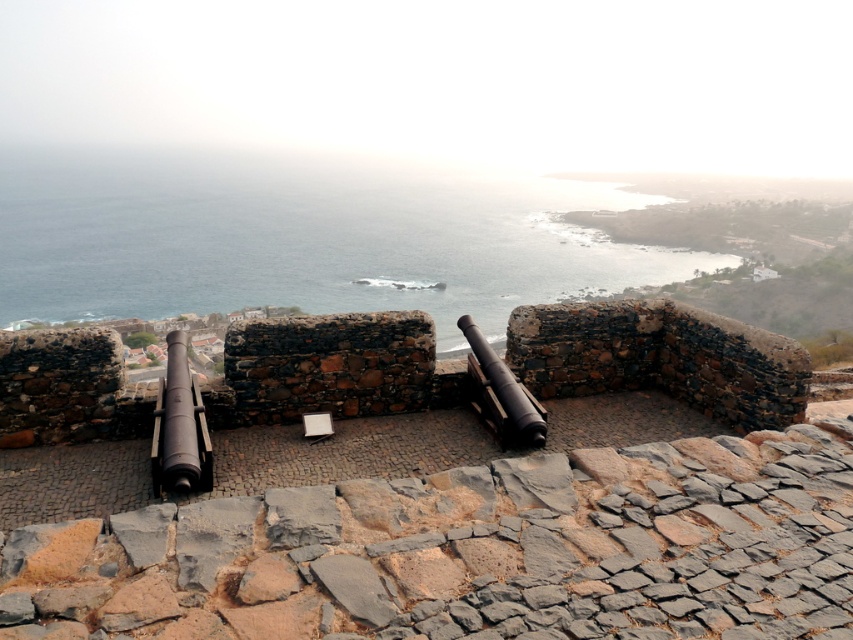
Who is more distant from viewer, (169, 486) or (483, 337)?

Positioned behind is point (483, 337).

Locate an element on the screen. polished bronze cannon at left is located at coordinates (178, 428).

Where is `polished bronze cannon at left`? polished bronze cannon at left is located at coordinates (178, 428).

Is blue water at center thinner than polished bronze cannon at left?

No, blue water at center is not thinner than polished bronze cannon at left.

Is point (448, 349) closer to viewer compared to point (157, 420)?

No, it is not.

Locate an element on the screen. This screenshot has width=853, height=640. blue water at center is located at coordinates (300, 237).

Where is `blue water at center`? blue water at center is located at coordinates (300, 237).

Can you confirm if blue water at center is wider than rusty metal cannon at center?

Result: Yes.

Which is behind, point (372, 180) or point (543, 420)?

Positioned behind is point (372, 180).

The width and height of the screenshot is (853, 640). I want to click on blue water at center, so pyautogui.click(x=300, y=237).